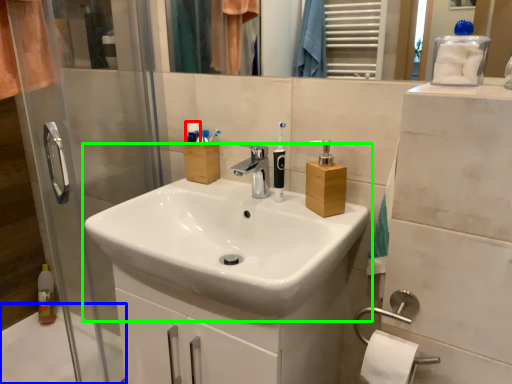
Question: Which is farther away from toiletry (highlighted by a red box)? bath (highlighted by a blue box) or sink (highlighted by a green box)?

Choices:
 (A) bath
 (B) sink

Answer: (A)